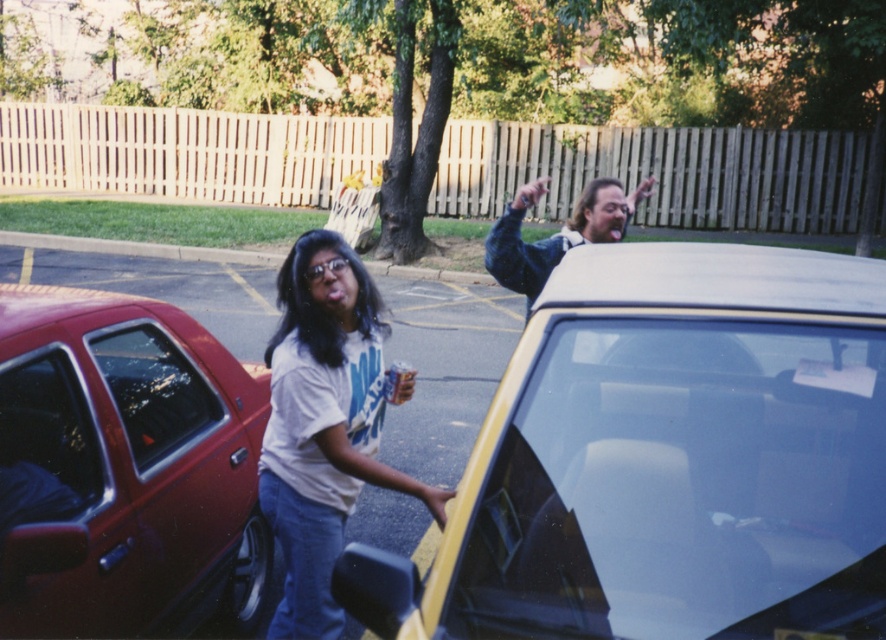
Is denim jacket at upper right further to camera compared to matte plastic hand at upper right?

No, denim jacket at upper right is in front of matte plastic hand at upper right.

Does denim jacket at upper right have a smaller size compared to matte plastic hand at upper right?

No.

Which is in front, point (500, 257) or point (632, 205)?

Point (500, 257) is in front.

Locate an element on the screen. This screenshot has height=640, width=886. denim jacket at upper right is located at coordinates (556, 232).

Is shiny red car at left below smooth yellow car door handle at lower center?

Actually, shiny red car at left is above smooth yellow car door handle at lower center.

What do you see at coordinates (123, 468) in the screenshot? I see `shiny red car at left` at bounding box center [123, 468].

Locate an element on the screen. This screenshot has height=640, width=886. shiny red car at left is located at coordinates (123, 468).

Between point (439, 506) and point (641, 198), which one is positioned behind?

The point (641, 198) is behind.

Who is lower down, smooth yellow car door handle at lower center or matte plastic hand at upper right?

smooth yellow car door handle at lower center is lower down.

Locate an element on the screen. smooth yellow car door handle at lower center is located at coordinates (436, 502).